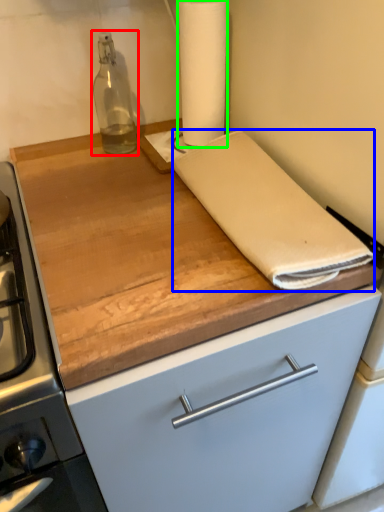
Question: Which object is positioned closest to bottle (highlighted by a red box)? Select from linen (highlighted by a blue box) and paper towel (highlighted by a green box).

Choices:
 (A) linen
 (B) paper towel

Answer: (B)